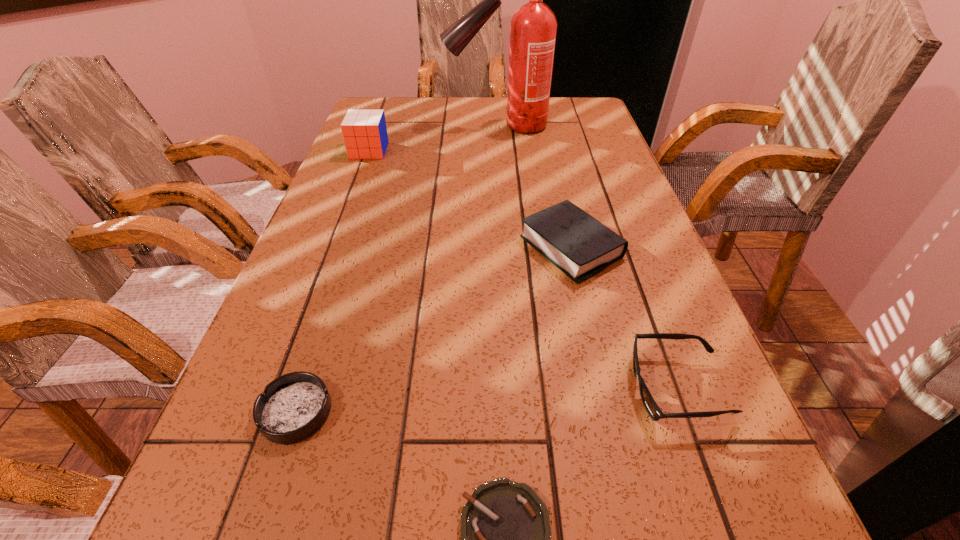
At what (x,y) coordinates should I click in order to perform the action: click on fire extinguisher that is at the right edge. Please return your answer as a coordinate pair (x, y). This screenshot has height=540, width=960. Looking at the image, I should click on (533, 28).

This screenshot has height=540, width=960. I want to click on Bible located at the right edge, so click(579, 245).

Locate an element on the screen. sunglasses that is at the right edge is located at coordinates (655, 413).

Where is `object that is at the far right corner`? This screenshot has width=960, height=540. object that is at the far right corner is located at coordinates (533, 28).

The height and width of the screenshot is (540, 960). In the image, there is a desktop. Identify the location of vacant region at the far edge. (428, 111).

In the image, there is a desktop. Identify the location of vacant space at the left edge. (390, 148).

Locate an element on the screen. vacant region at the right edge is located at coordinates point(580,147).

The image size is (960, 540). What are the coordinates of `vacant region at the far right corner` in the screenshot? It's located at (558, 122).

The height and width of the screenshot is (540, 960). What are the coordinates of `unoccupied area between the Bible and the fifth shortest object` in the screenshot? It's located at (470, 199).

The width and height of the screenshot is (960, 540). What are the coordinates of `vacant region between the fifth shortest object and the fifth tallest object` in the screenshot? It's located at (332, 281).